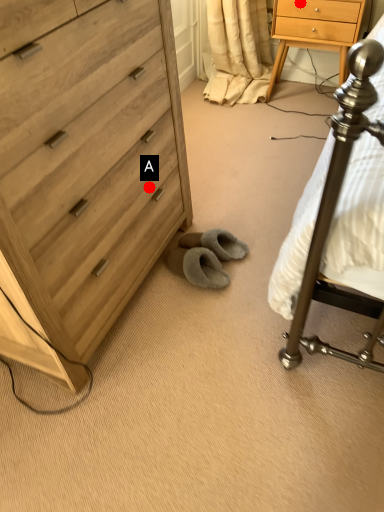
Question: Two points are circled on the image, labeled by A and B beside each circle. Which point appears farthest from the camera in this image?

Choices:
 (A) A is further
 (B) B is further

Answer: (B)